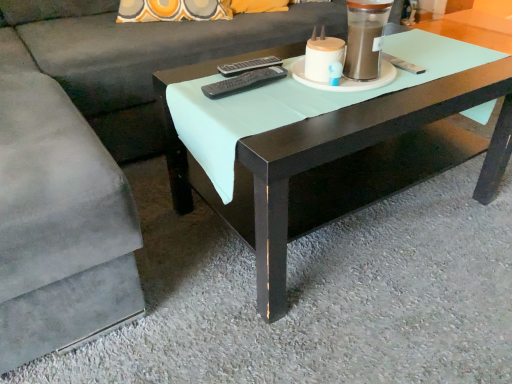
Image resolution: width=512 pixels, height=384 pixels. Identify the location of vacant space in front of black plastic remote at center, which is the 1th remote in back-to-front order. (256, 92).